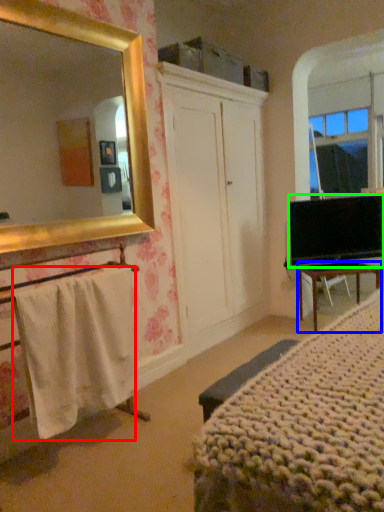
Question: Considering the real-world distances, which object is farthest from towel/napkin (highlighted by a red box)? desk (highlighted by a blue box) or television (highlighted by a green box)?

Choices:
 (A) desk
 (B) television

Answer: (B)